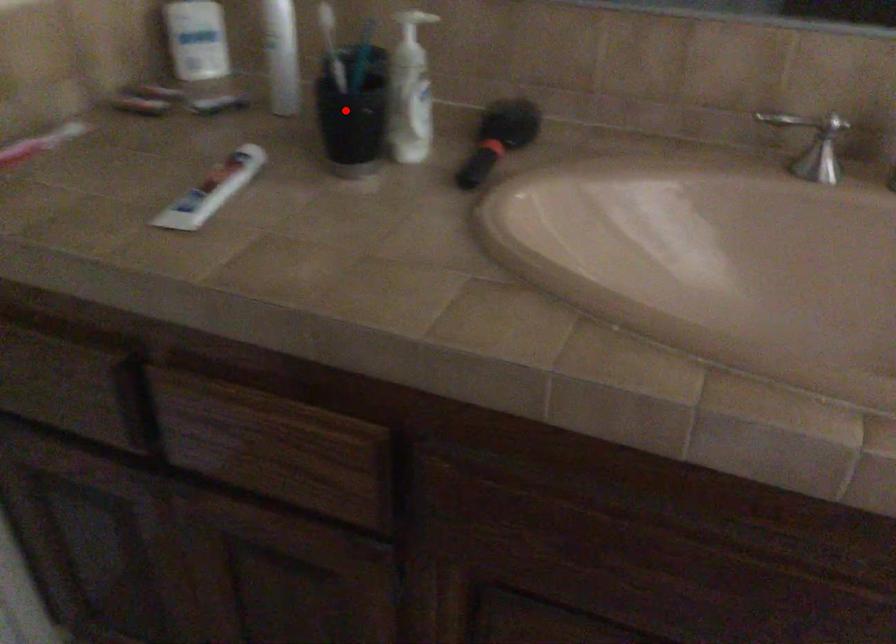
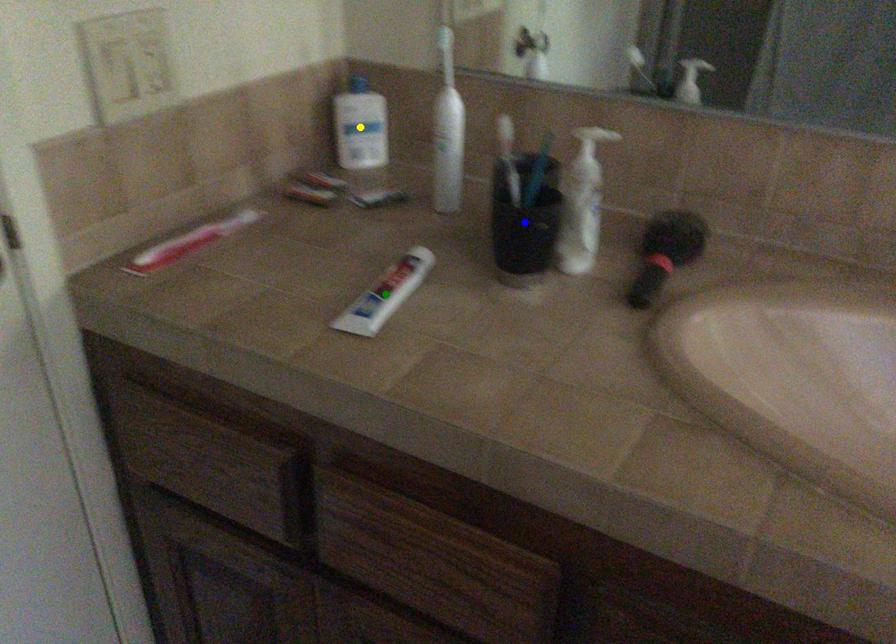
Question: I am providing you with two images of the same scene from different viewpoints. A red point is marked on the first image. You are given multiple points on the second image. Can you choose the point in image 2 that corresponds to the point in image 1?

Choices:
 (A) yellow point
 (B) green point
 (C) blue point

Answer: (C)